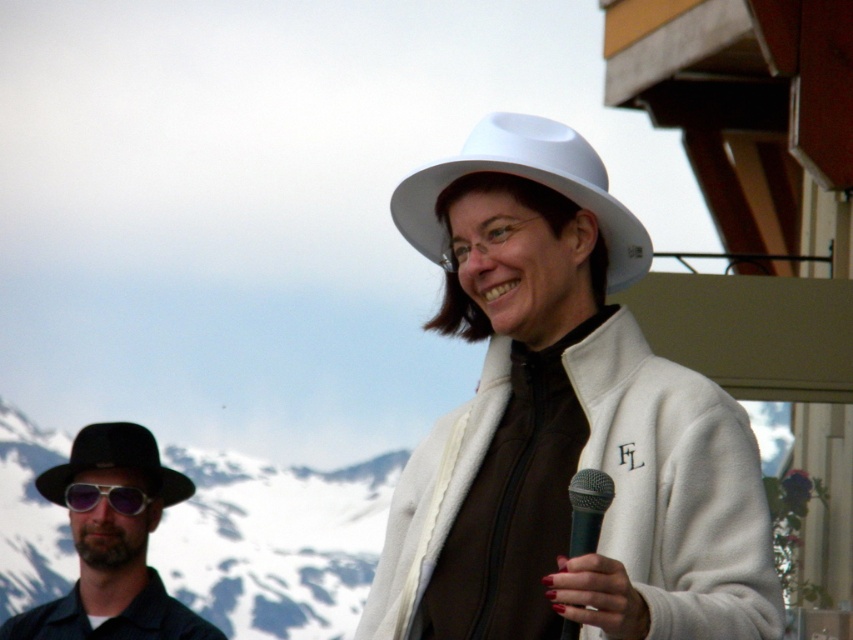
You are standing at the point marked as point (273,541) in the image. What object is located at this point?

The point (273,541) corresponds to the snowy mountain at left.

You are standing at the point with coordinates point (x=202, y=545) and want to move towards the point with coordinates point (x=576, y=492). Based on the scene, will you be moving forward or backward relative to your current position?

Since point (x=202, y=545) is behind point (x=576, y=492), moving from point (x=202, y=545) to point (x=576, y=492) would require moving forward towards the direction of the point (x=576, y=492).

Based on the photo, you are a photographer trying to capture a clear shot of the snowy mountain at left and the purple reflective goggles at left. However, the goggles are reflecting the sky. Which object should you adjust your camera angle to avoid the reflection?

The purple reflective goggles at left are reflecting the sky, so adjusting the camera angle to avoid the reflection would allow you to capture the snowy mountain at left clearly.